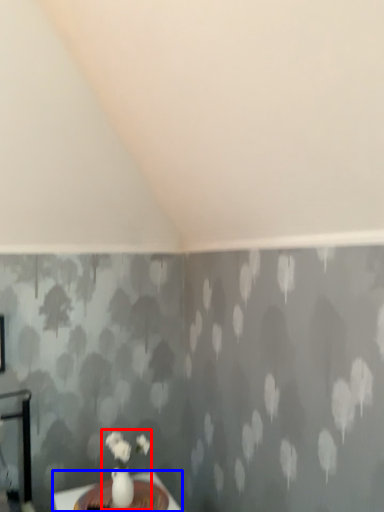
Question: Which point is closer to the camera, floral arrangement (highlighted by a red box) or table (highlighted by a blue box)?

Choices:
 (A) floral arrangement
 (B) table

Answer: (B)